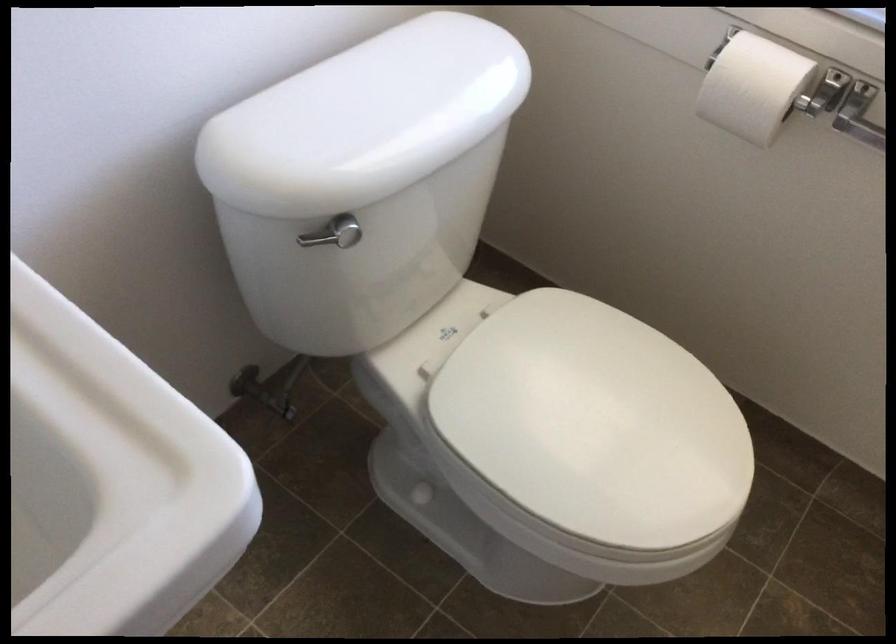
Describe the element at coordinates (595, 422) in the screenshot. I see `the white toilet seat` at that location.